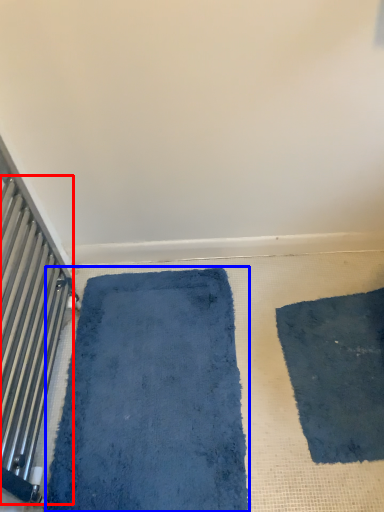
Question: Which object is closer to the camera taking this photo, radiator (highlighted by a red box) or bath mat (highlighted by a blue box)?

Choices:
 (A) radiator
 (B) bath mat

Answer: (A)